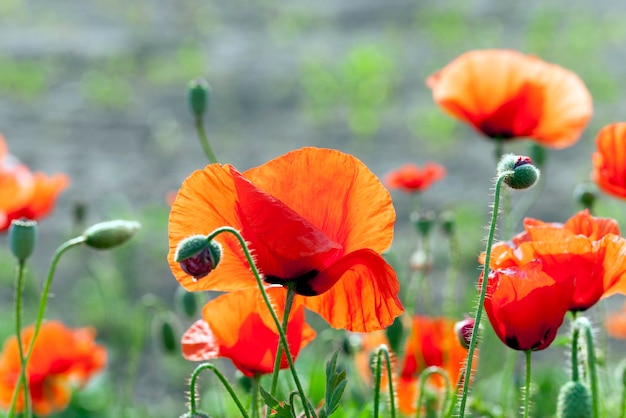
Locate an element on the screen. Image resolution: width=626 pixels, height=418 pixels. bulb is located at coordinates (196, 258).